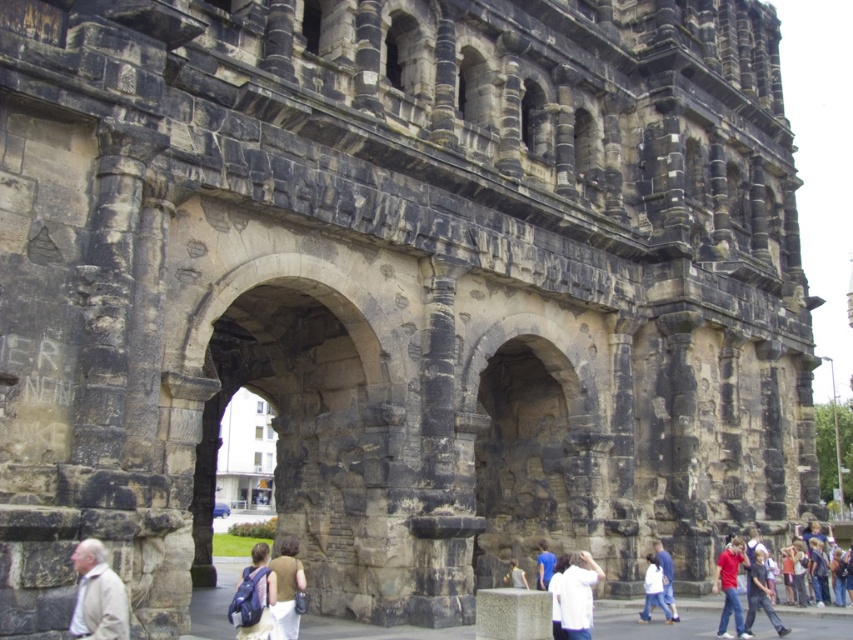
Can you confirm if white matte shirt at lower center is thinner than white cotton shirt at lower right?

In fact, white matte shirt at lower center might be wider than white cotton shirt at lower right.

Based on the photo, can you confirm if white matte shirt at lower center is positioned above white cotton shirt at lower right?

Yes.

What are the coordinates of `white matte shirt at lower center` in the screenshot? It's located at (578, 596).

Between brown fabric backpack at center and denim jacket at lower right, which one has less height?

denim jacket at lower right is shorter.

The image size is (853, 640). I want to click on brown fabric backpack at center, so click(x=286, y=589).

Is point (294, 609) farther from camera compared to point (663, 548)?

No, it is in front of (663, 548).

Identify the location of brown fabric backpack at center. (286, 589).

The image size is (853, 640). Describe the element at coordinates (759, 593) in the screenshot. I see `red shirt at lower right` at that location.

Can you confirm if red shirt at lower right is taller than light brown leather jacket at lower center?

Yes, red shirt at lower right is taller than light brown leather jacket at lower center.

Who is more distant from viewer, (753, 563) or (524, 579)?

The point (524, 579) is behind.

What are the coordinates of `red shirt at lower right` in the screenshot? It's located at (759, 593).